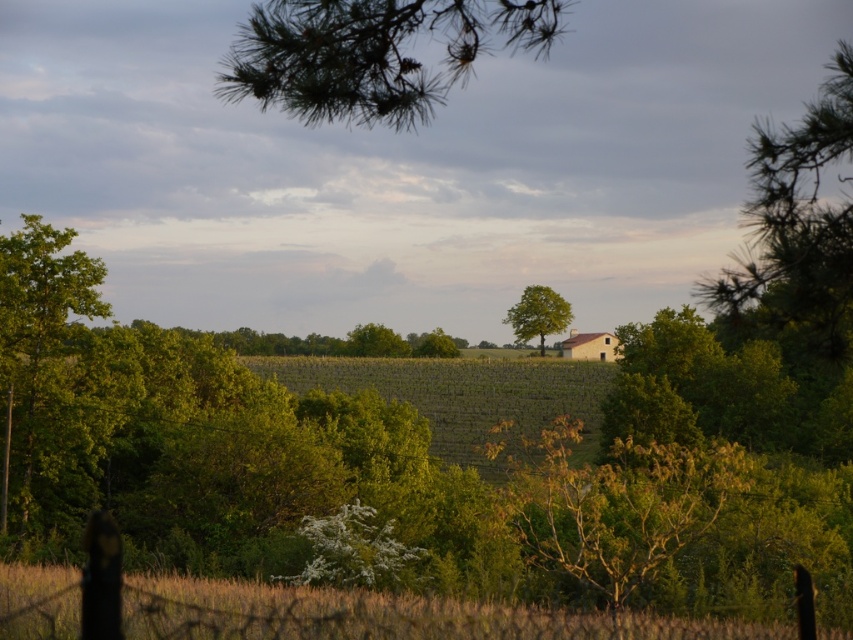
Between green leafy tree at left and green leafy tree at center, which one has less height?

With less height is green leafy tree at center.

Is point (54, 250) less distant than point (526, 312)?

Yes, it is.

What are the coordinates of `green leafy tree at left` in the screenshot? It's located at (45, 376).

In the scene shown: Is brown wire fence at lower center smaller than green leafy tree at center?

Indeed, brown wire fence at lower center has a smaller size compared to green leafy tree at center.

Between point (74, 636) and point (548, 330), which one is positioned in front?

Point (74, 636)

Locate an element on the screen. brown wire fence at lower center is located at coordinates (293, 609).

Where is `brown wire fence at lower center`? This screenshot has width=853, height=640. brown wire fence at lower center is located at coordinates (293, 609).

Is brown wire fence at lower center in front of green needle-like at upper center?

Yes.

Does brown wire fence at lower center have a lesser height compared to green needle-like at upper center?

Correct, brown wire fence at lower center is not as tall as green needle-like at upper center.

Between point (113, 564) and point (294, 40), which one is positioned behind?

The point (113, 564) is behind.

You are a GUI agent. You are given a task and a screenshot of the screen. Output one action in this format:
    pyautogui.click(x=<x>, y=<y>)
    Task: Click on the brown wire fence at lower center
    The height and width of the screenshot is (640, 853).
    Given the screenshot: What is the action you would take?
    coord(293,609)